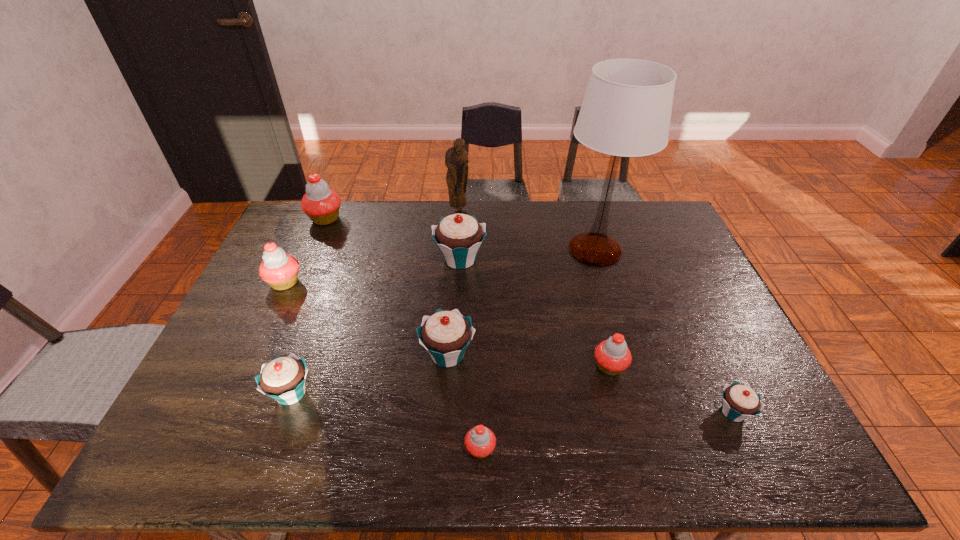
Locate an element on the screen. The image size is (960, 540). vacant point located between the figurine and the tallest object is located at coordinates (527, 230).

Where is `vacant region between the third biggest teal cupcake and the rightmost red cupcake`? This screenshot has height=540, width=960. vacant region between the third biggest teal cupcake and the rightmost red cupcake is located at coordinates (x=450, y=380).

Locate an element on the screen. This screenshot has height=540, width=960. free space between the rightmost object and the third red cupcake from left to right is located at coordinates (607, 430).

Where is `object that is the fifth closest to the rightmost teal cupcake`? The image size is (960, 540). object that is the fifth closest to the rightmost teal cupcake is located at coordinates (459, 236).

This screenshot has width=960, height=540. What are the coordinates of `object that is the eighth closest to the third smallest red cupcake` in the screenshot? It's located at (613, 356).

Where is `cupcake that is the third closest to the nearest cupcake`? The image size is (960, 540). cupcake that is the third closest to the nearest cupcake is located at coordinates (283, 379).

The width and height of the screenshot is (960, 540). I want to click on cupcake that is the nearest to the nearest red cupcake, so click(445, 335).

Select which teal cupcake appears as the second closest to the leftmost teal cupcake. Please provide its 2D coordinates. Your answer should be formatted as a tuple, i.e. [(x, y)], where the tuple contains the x and y coordinates of a point satisfying the conditions above.

[(459, 236)]

Select which teal cupcake appears as the third closest to the third smallest teal cupcake. Please provide its 2D coordinates. Your answer should be formatted as a tuple, i.e. [(x, y)], where the tuple contains the x and y coordinates of a point satisfying the conditions above.

[(739, 401)]

Image resolution: width=960 pixels, height=540 pixels. Identify the location of red cupcake that is the third closest to the biggest teal cupcake. (279, 269).